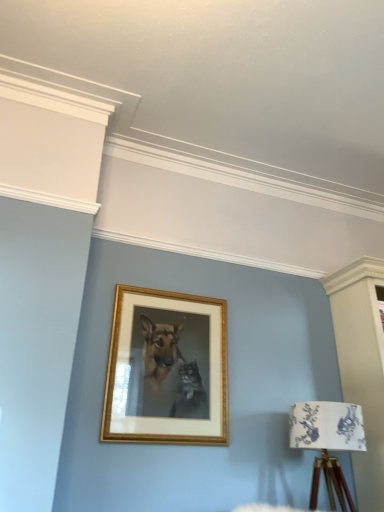
Question: From the image's perspective, relative to gold wooden picture frame at center, is white floral fabric at lower right above or below?

Choices:
 (A) below
 (B) above

Answer: (A)

Question: In terms of size, does white floral fabric at lower right appear bigger or smaller than gold wooden picture frame at center?

Choices:
 (A) big
 (B) small

Answer: (A)

Question: In the image, is white floral fabric at lower right positioned in front of or behind gold wooden picture frame at center?

Choices:
 (A) front
 (B) behind

Answer: (A)

Question: In terms of height, does gold wooden picture frame at center look taller or shorter compared to white floral fabric at lower right?

Choices:
 (A) tall
 (B) short

Answer: (A)

Question: From a real-world perspective, is gold wooden picture frame at center positioned above or below white floral fabric at lower right?

Choices:
 (A) above
 (B) below

Answer: (A)

Question: Considering the positions of gold wooden picture frame at center and white floral fabric at lower right in the image, is gold wooden picture frame at center bigger or smaller than white floral fabric at lower right?

Choices:
 (A) big
 (B) small

Answer: (B)

Question: Would you say gold wooden picture frame at center is to the left or to the right of white floral fabric at lower right in the picture?

Choices:
 (A) left
 (B) right

Answer: (A)